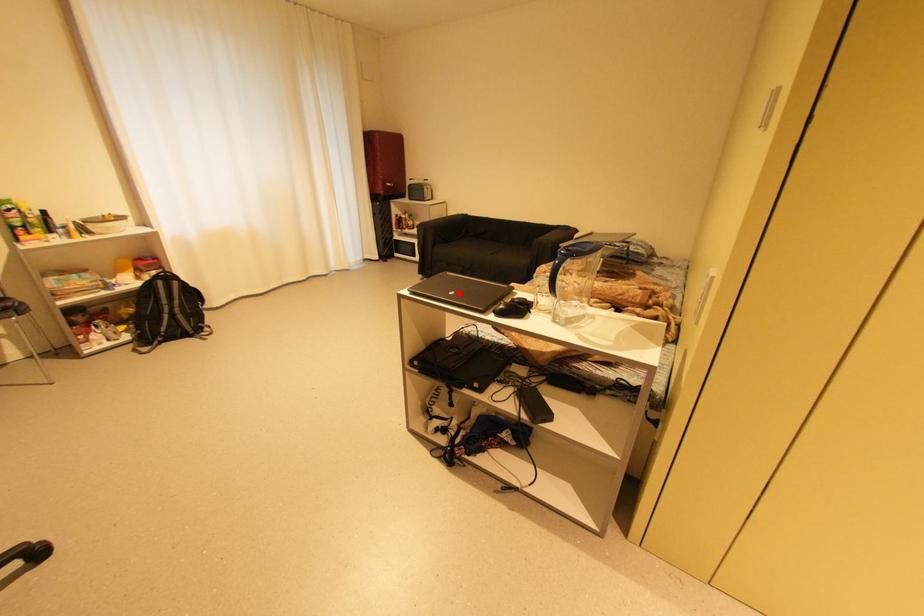
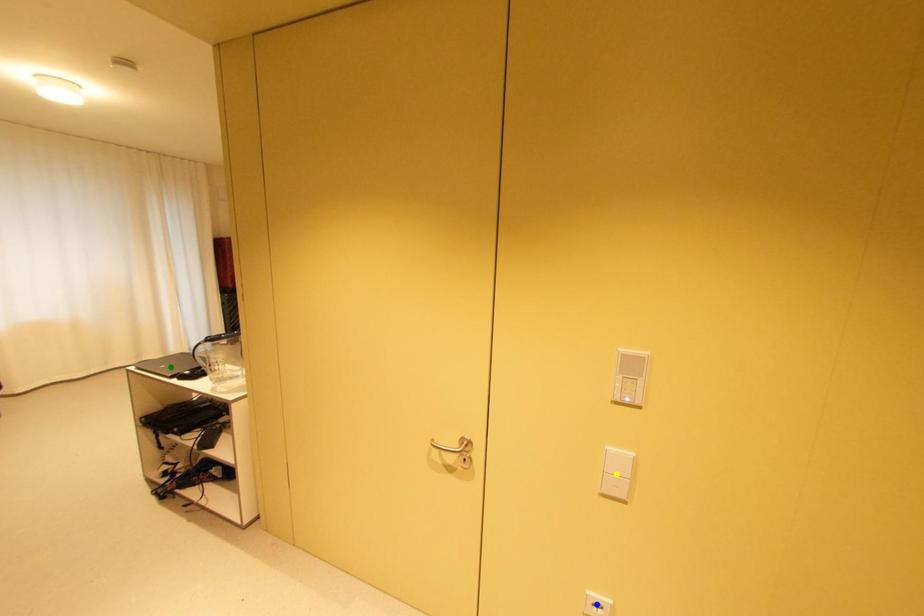
Question: I am providing you with two images of the same scene from different viewpoints. A red point is marked on the first image. You are given multiple points on the second image. Which point in image 2 represents the same 3d spot as the red point in image 1?

Choices:
 (A) blue point
 (B) green point
 (C) yellow point

Answer: (B)